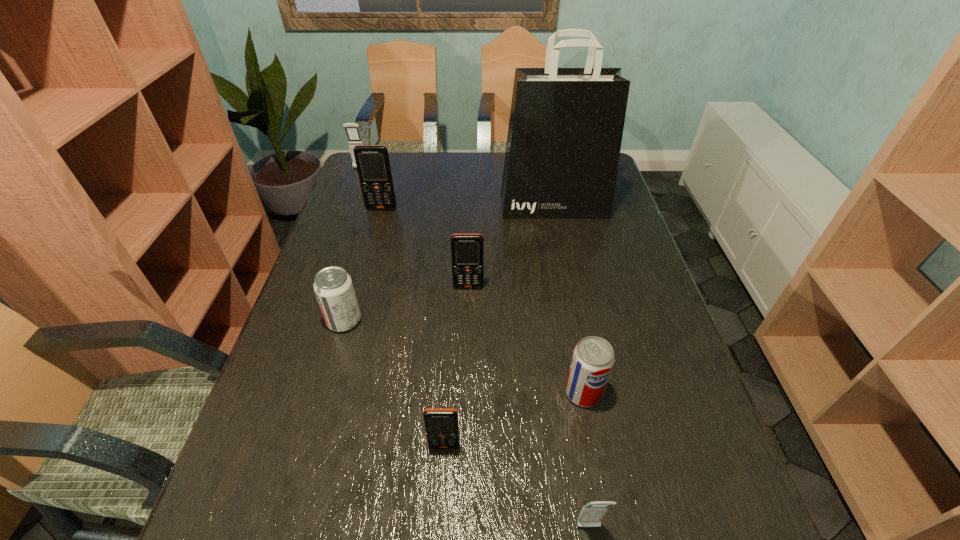
At what (x,y) coordinates should I click in order to perform the action: click on gray shopping bag. Please return your answer as a coordinate pair (x, y). The height and width of the screenshot is (540, 960). Looking at the image, I should click on (565, 131).

Where is `shopping bag`? The height and width of the screenshot is (540, 960). shopping bag is located at coordinates (565, 131).

You are a GUI agent. You are given a task and a screenshot of the screen. Output one action in this format:
    pyautogui.click(x=<x>, y=<y>)
    Task: Click on the second cellular telephone from left to right
    The image size is (960, 540).
    Given the screenshot: What is the action you would take?
    pyautogui.click(x=373, y=165)

Find the location of a particular element. the leftmost orange cellular telephone is located at coordinates (373, 165).

The image size is (960, 540). I want to click on the leftmost cellular telephone, so click(x=352, y=130).

Locate an element on the screen. The height and width of the screenshot is (540, 960). the leftmost object is located at coordinates tap(352, 130).

Find the location of a particular element. This screenshot has height=540, width=960. the fourth farthest object is located at coordinates (467, 250).

Find the location of `the second biggest orange cellular telephone`. the second biggest orange cellular telephone is located at coordinates (467, 250).

Locate an element on the screen. The height and width of the screenshot is (540, 960). the right soda can is located at coordinates (593, 357).

At what (x,y) coordinates should I click in order to perform the action: click on the third nearest object. Please return your answer as a coordinate pair (x, y). This screenshot has width=960, height=540. Looking at the image, I should click on (593, 357).